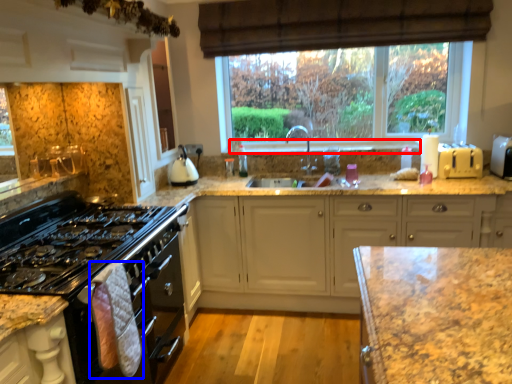
Question: Which of the following is the closest to the observer, window sill (highlighted by a red box) or material (highlighted by a blue box)?

Choices:
 (A) window sill
 (B) material

Answer: (B)